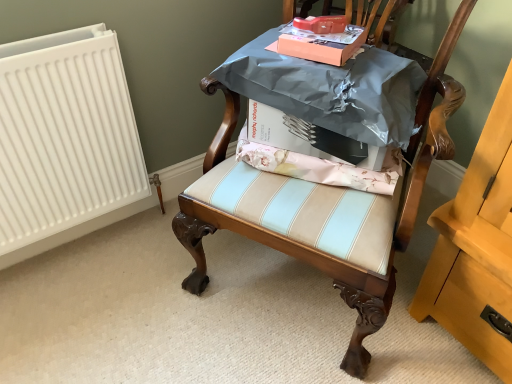
Question: Considering their positions, is white cardboard box at center, which ranks as the first cardboard box in bottom-to-top order, located in front of or behind matte orange cardboard box at upper center, the 2th cardboard box positioned from the bottom?

Choices:
 (A) behind
 (B) front

Answer: (A)

Question: Looking at the image, does white cardboard box at center, which ranks as the first cardboard box in bottom-to-top order, seem bigger or smaller compared to matte orange cardboard box at upper center, the first cardboard box in the top-to-bottom sequence?

Choices:
 (A) small
 (B) big

Answer: (B)

Question: Which is farther from the matte orange cardboard box at upper center, the first cardboard box in the top-to-bottom sequence?

Choices:
 (A) white cardboard box at center, which is the 2th cardboard box from top to bottom
 (B) pink floral fabric at center
 (C) wooden chair at center

Answer: (C)

Question: Which is farther from the wooden chair at center?

Choices:
 (A) pink floral fabric at center
 (B) white cardboard box at center, which ranks as the first cardboard box in bottom-to-top order
 (C) matte orange cardboard box at upper center, the first cardboard box in the top-to-bottom sequence

Answer: (C)